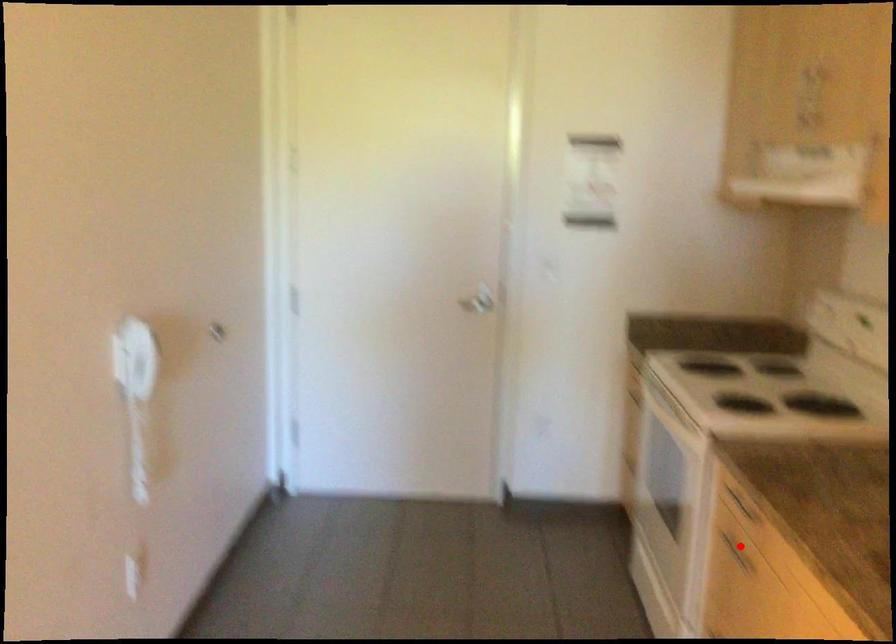
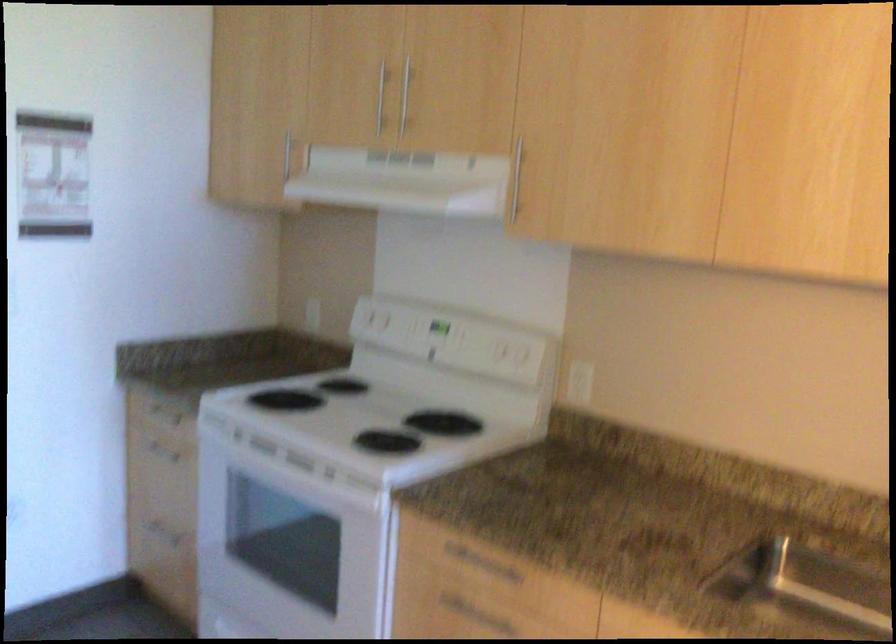
Question: I am providing you with two images of the same scene from different viewpoints. In image1, a red point is highlighted. Considering the same 3D point in image2, which of the following is correct?

Choices:
 (A) It is closer
 (B) It is farther

Answer: (A)